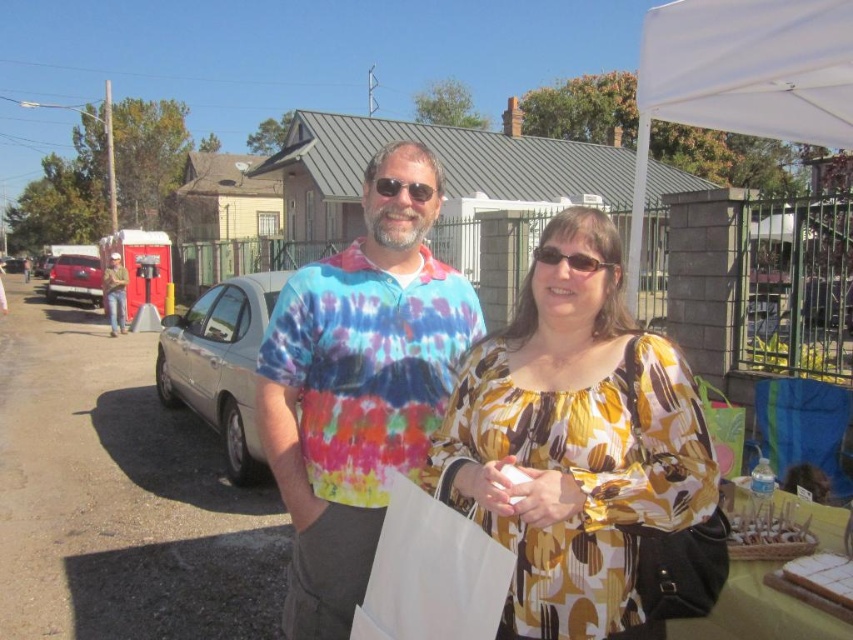
Can you confirm if yellow printed blouse at center is taller than black plastic sunglasses at center?

Indeed, yellow printed blouse at center has a greater height compared to black plastic sunglasses at center.

What do you see at coordinates (575, 444) in the screenshot?
I see `yellow printed blouse at center` at bounding box center [575, 444].

Locate an element on the screen. This screenshot has height=640, width=853. yellow printed blouse at center is located at coordinates point(575,444).

How far apart are tie-dye fabric shirt at center and matte plastic sunglasses at center?

12.07 inches

Does point (418, 337) come in front of point (409, 192)?

No, it is behind (409, 192).

Is point (331, 435) less distant than point (428, 196)?

Yes, it is.

You are a GUI agent. You are given a task and a screenshot of the screen. Output one action in this format:
    pyautogui.click(x=<x>, y=<y>)
    Task: Click on the tie-dye fabric shirt at center
    The width and height of the screenshot is (853, 640).
    Given the screenshot: What is the action you would take?
    pyautogui.click(x=358, y=387)

Can you confirm if tie-dye fabric shirt at center is smaller than shiny red car at left?

Yes, tie-dye fabric shirt at center is smaller than shiny red car at left.

Is tie-dye fabric shirt at center behind shiny red car at left?

No, tie-dye fabric shirt at center is in front of shiny red car at left.

Which is behind, point (316, 628) or point (59, 285)?

Point (59, 285)

This screenshot has height=640, width=853. I want to click on tie-dye fabric shirt at center, so click(358, 387).